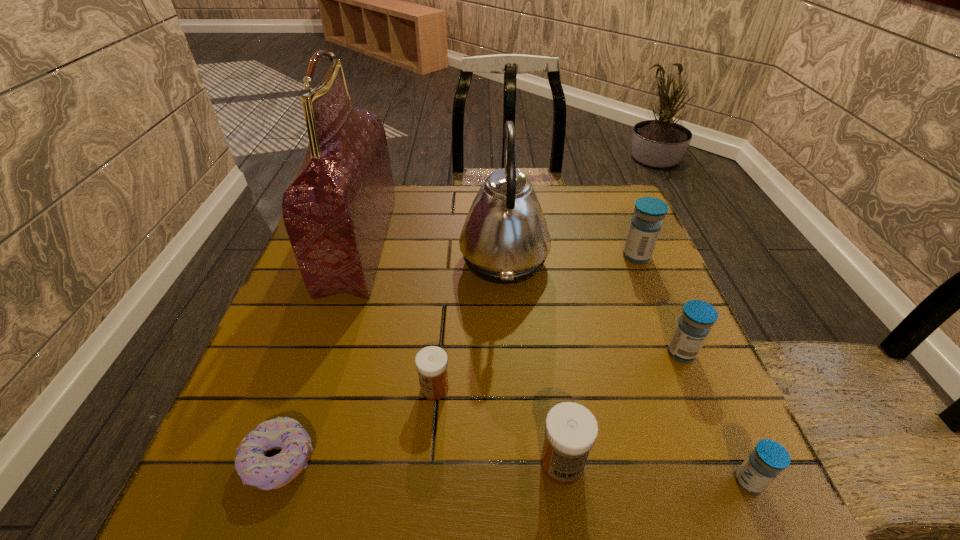
I want to click on the smallest blue medicine, so click(767, 460).

At what (x,y) coordinates should I click in order to perform the action: click on doughnut. Please return your answer as a coordinate pair (x, y). This screenshot has height=540, width=960. Looking at the image, I should click on (255, 469).

Where is `the shortest object`? The width and height of the screenshot is (960, 540). the shortest object is located at coordinates (255, 469).

Identify the location of blank space located on the front-facing side of the handbag. This screenshot has height=540, width=960. (500, 244).

In order to click on vacant area situated 0.090m from the spout of the kettle in this screenshot , I will do `click(423, 259)`.

This screenshot has width=960, height=540. I want to click on free space located 0.390m from the spout of the kettle, so click(x=303, y=259).

Where is `vacant space located 0.140m from the spout of the kettle`? The height and width of the screenshot is (540, 960). vacant space located 0.140m from the spout of the kettle is located at coordinates (403, 259).

You are a GUI agent. You are given a task and a screenshot of the screen. Output one action in this format:
    pyautogui.click(x=<x>, y=<y>)
    Task: Click on the vacant space located on the left of the farthest medicine
    The width and height of the screenshot is (960, 540).
    Given the screenshot: What is the action you would take?
    pyautogui.click(x=474, y=256)

Locate an element on the screen. Image resolution: width=960 pixels, height=540 pixels. free spot located on the left of the second biggest blue medicine is located at coordinates (612, 353).

I want to click on vacant area situated 0.090m on the back of the right white medicine, so click(552, 395).